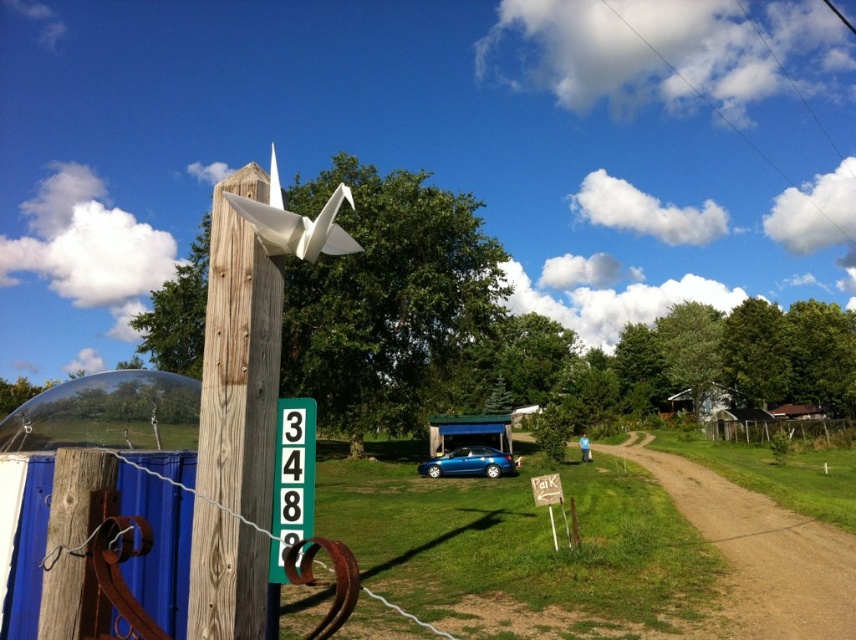
Who is lower down, wooden fence at right or metallic blue car at center?

wooden fence at right is below.

Is wooden fence at right taller than metallic blue car at center?

Yes, wooden fence at right is taller than metallic blue car at center.

What do you see at coordinates (782, 429) in the screenshot? Image resolution: width=856 pixels, height=640 pixels. I see `wooden fence at right` at bounding box center [782, 429].

Where is `wooden fence at right`? Image resolution: width=856 pixels, height=640 pixels. wooden fence at right is located at coordinates (782, 429).

Is point (758, 560) closer to camera compared to point (271, 188)?

No, it is not.

Who is more distant from viewer, (750, 632) or (355, 243)?

The point (750, 632) is more distant.

Locate an element on the screen. This screenshot has height=640, width=856. brown dirt track at lower right is located at coordinates (759, 554).

How far apart are wooden post at left and white paper crane at upper center?

wooden post at left is 13.18 meters away from white paper crane at upper center.

Identify the location of wooden post at left. This screenshot has width=856, height=640. (235, 422).